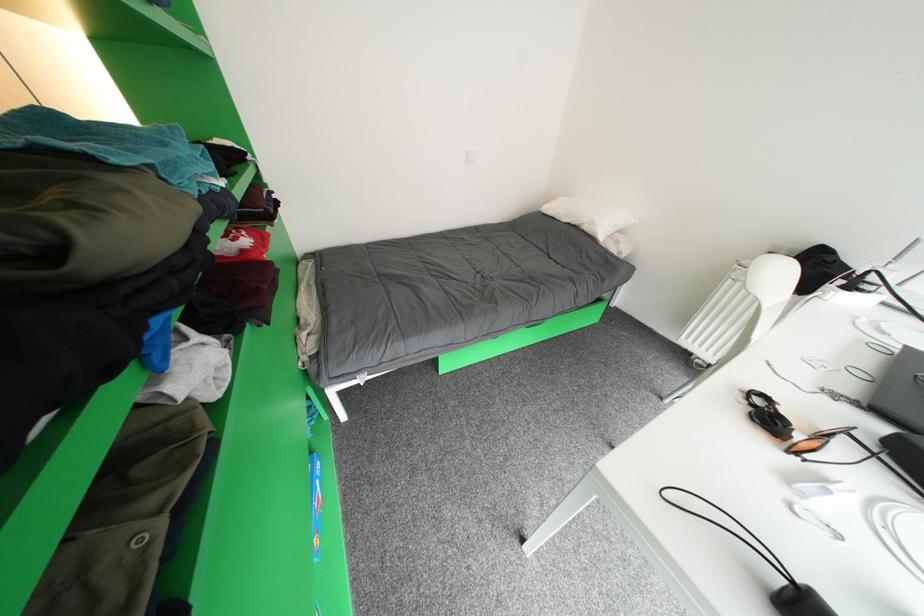
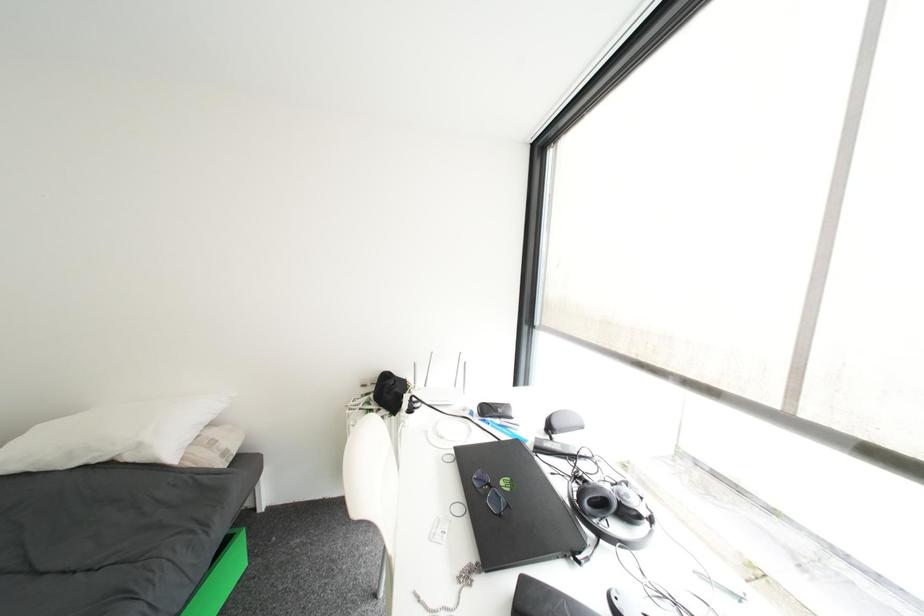
Question: The camera is either moving clockwise (left) or counter-clockwise (right) around the object. The first image is from the beginning of the video and the second image is from the end. Is the camera moving left or right when shooting the video?

Choices:
 (A) Left
 (B) Right

Answer: (A)